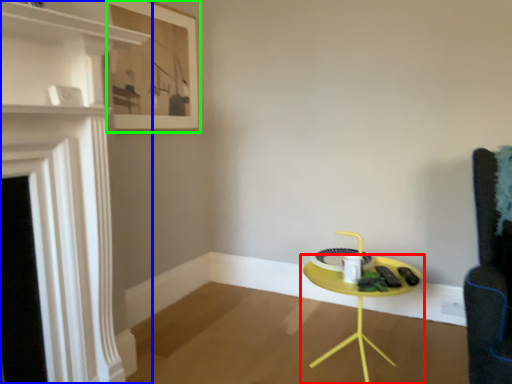
Question: Which object is positioned farthest from table (highlighted by a red box)? Select from fireplace (highlighted by a blue box) and picture frame (highlighted by a green box).

Choices:
 (A) fireplace
 (B) picture frame

Answer: (B)